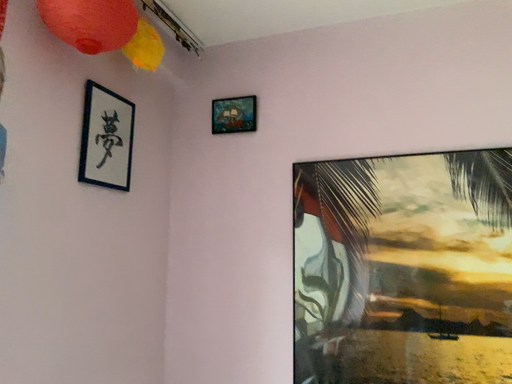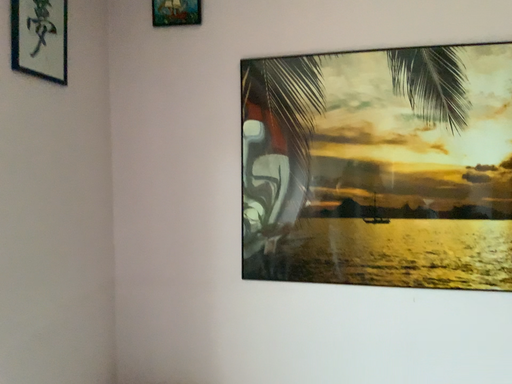
Question: Which way did the camera rotate in the video?

Choices:
 (A) rotated upward
 (B) rotated downward

Answer: (B)